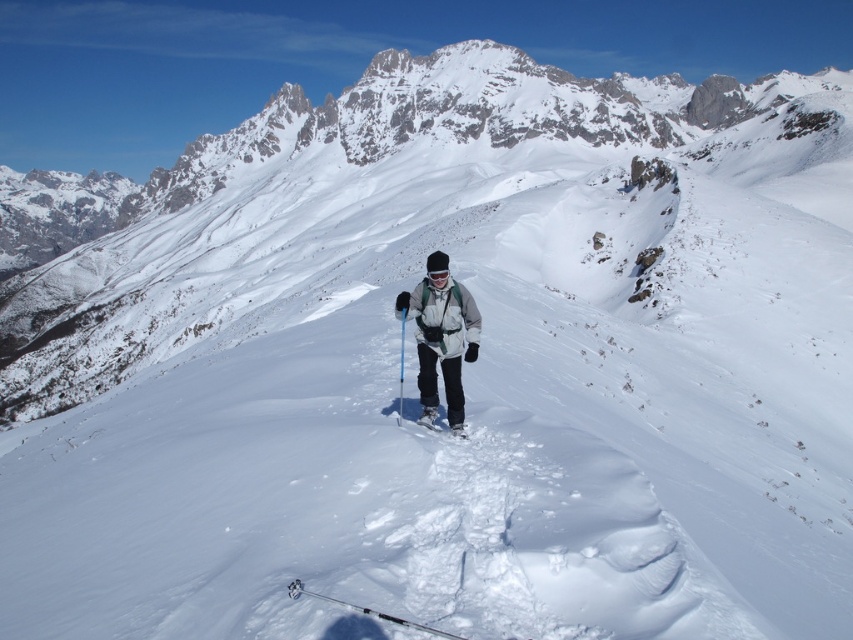
Does white matte ski at center have a greater height compared to matte black ski pole at center?

In fact, white matte ski at center may be shorter than matte black ski pole at center.

Is point (450, 428) less distant than point (399, 385)?

Yes, it is.

Identify the location of white matte ski at center. (428, 419).

The height and width of the screenshot is (640, 853). I want to click on white matte ski at center, so click(428, 419).

Which is above, matte gray jacket at center or matte black ski pole at center?

matte black ski pole at center

Between point (463, 348) and point (402, 337), which one is positioned behind?

Positioned behind is point (402, 337).

What do you see at coordinates (440, 337) in the screenshot?
I see `matte gray jacket at center` at bounding box center [440, 337].

The image size is (853, 640). What are the coordinates of `matte gray jacket at center` in the screenshot? It's located at (440, 337).

At what (x,y) coordinates should I click in order to perform the action: click on black plastic ski pole at lower center. Please return your answer as a coordinate pair (x, y). Image resolution: width=853 pixels, height=640 pixels. Looking at the image, I should click on (366, 611).

Is black plastic ski pole at lower center smaller than matte black ski pole at center?

Correct, black plastic ski pole at lower center occupies less space than matte black ski pole at center.

Find the location of `black plastic ski pole at lower center`. black plastic ski pole at lower center is located at coordinates (366, 611).